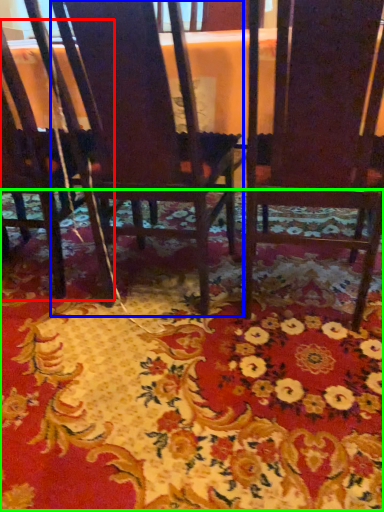
Question: Which object is the farthest from chair (highlighted by a red box)? Choose among these: chair (highlighted by a blue box) or mat (highlighted by a green box).

Choices:
 (A) chair
 (B) mat

Answer: (B)